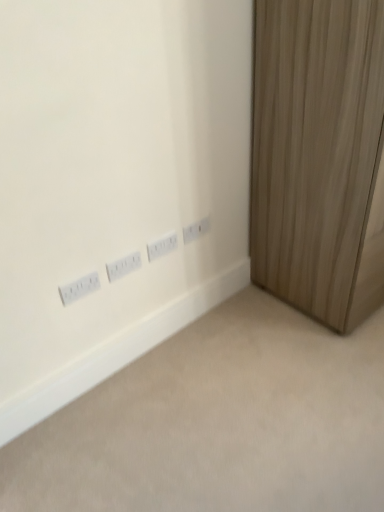
Question: From a real-world perspective, is white plastic power plugs and sockets at lower left, which appears as the first power plugs and sockets when viewed from the left, physically below white plastic power plugs and sockets at center, marked as the 2th power plugs and sockets in a left-to-right arrangement?

Choices:
 (A) yes
 (B) no

Answer: (B)

Question: Considering the relative sizes of white plastic power plugs and sockets at lower left, marked as the 4th power plugs and sockets in a right-to-left arrangement, and white plastic power plugs and sockets at center, the 3th power plugs and sockets viewed from the right, in the image provided, is white plastic power plugs and sockets at lower left, marked as the 4th power plugs and sockets in a right-to-left arrangement, thinner than white plastic power plugs and sockets at center, the 3th power plugs and sockets viewed from the right,?

Choices:
 (A) no
 (B) yes

Answer: (A)

Question: Can we say white plastic power plugs and sockets at lower left, which appears as the first power plugs and sockets when viewed from the left, lies outside white plastic power plugs and sockets at center, marked as the 2th power plugs and sockets in a left-to-right arrangement?

Choices:
 (A) yes
 (B) no

Answer: (A)

Question: Does white plastic power plugs and sockets at lower left, marked as the 4th power plugs and sockets in a right-to-left arrangement, have a lesser height compared to white plastic power plugs and sockets at center, marked as the 2th power plugs and sockets in a left-to-right arrangement?

Choices:
 (A) no
 (B) yes

Answer: (B)

Question: Is white plastic power plugs and sockets at lower left, marked as the 4th power plugs and sockets in a right-to-left arrangement, turned away from white plastic power plugs and sockets at center, the 3th power plugs and sockets viewed from the right?

Choices:
 (A) yes
 (B) no

Answer: (B)

Question: Is point (89, 290) closer or farther from the camera than point (311, 119)?

Choices:
 (A) farther
 (B) closer

Answer: (A)

Question: Which is correct: white plastic power plugs and sockets at lower left, which appears as the first power plugs and sockets when viewed from the left, is inside wooden curtain at right, or outside of it?

Choices:
 (A) inside
 (B) outside

Answer: (B)

Question: From the image's perspective, is white plastic power plugs and sockets at lower left, which appears as the first power plugs and sockets when viewed from the left, above or below wooden curtain at right?

Choices:
 (A) above
 (B) below

Answer: (B)

Question: Considering their positions, is white plastic power plugs and sockets at lower left, which appears as the first power plugs and sockets when viewed from the left, located in front of or behind wooden curtain at right?

Choices:
 (A) front
 (B) behind

Answer: (B)

Question: In the image, is white plastic power plugs and sockets at center, the 3th power plugs and sockets in the left-to-right sequence, positioned in front of or behind white plastic outlets at lower left?

Choices:
 (A) front
 (B) behind

Answer: (B)

Question: Is white plastic power plugs and sockets at center, the 3th power plugs and sockets in the left-to-right sequence, taller or shorter than white plastic outlets at lower left?

Choices:
 (A) tall
 (B) short

Answer: (A)

Question: From a real-world perspective, is white plastic power plugs and sockets at center, the second power plugs and sockets from the right, positioned above or below white plastic outlets at lower left?

Choices:
 (A) above
 (B) below

Answer: (A)

Question: Based on their positions, is white plastic power plugs and sockets at center, the 3th power plugs and sockets in the left-to-right sequence, located to the left or right of white plastic outlets at lower left?

Choices:
 (A) left
 (B) right

Answer: (A)

Question: Is point (261, 129) closer or farther from the camera than point (187, 225)?

Choices:
 (A) farther
 (B) closer

Answer: (B)

Question: Is wooden curtain at right inside or outside of white plastic power plugs and sockets at center, which ranks as the first power plugs and sockets in right-to-left order?

Choices:
 (A) inside
 (B) outside

Answer: (B)